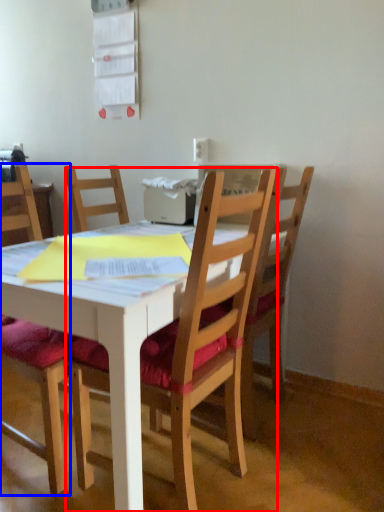
Question: Which object is closer to the camera taking this photo, chair (highlighted by a red box) or chair (highlighted by a blue box)?

Choices:
 (A) chair
 (B) chair

Answer: (A)